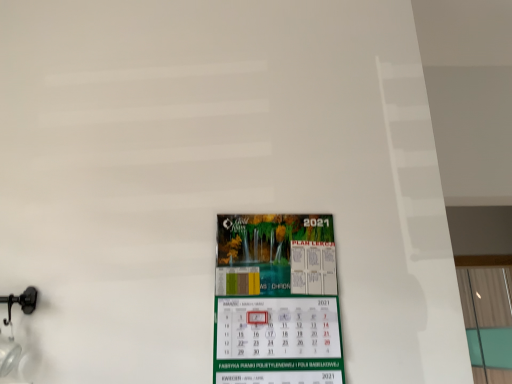
Identify the location of green paper calendar at center. Image resolution: width=512 pixels, height=384 pixels. (276, 300).

Image resolution: width=512 pixels, height=384 pixels. What do you see at coordinates (276, 300) in the screenshot?
I see `green paper calendar at center` at bounding box center [276, 300].

The height and width of the screenshot is (384, 512). Describe the element at coordinates (488, 321) in the screenshot. I see `transparent glass window at right` at that location.

This screenshot has width=512, height=384. I want to click on transparent glass window at right, so click(x=488, y=321).

In order to click on green paper calendar at center in this screenshot , I will do `click(276, 300)`.

Is green paper calendar at center to the left or to the right of transparent glass window at right in the image?

Clearly, green paper calendar at center is on the left of transparent glass window at right in the image.

Considering the positions of objects green paper calendar at center and transparent glass window at right in the image provided, who is behind, green paper calendar at center or transparent glass window at right?

transparent glass window at right is further from the camera.

Which is less distant, (288,339) or (494,308)?

Point (288,339) is closer to the camera than point (494,308).

From the image's perspective, which one is positioned lower, green paper calendar at center or transparent glass window at right?

transparent glass window at right is shown below in the image.

From a real-world perspective, between green paper calendar at center and transparent glass window at right, who is vertically higher?

transparent glass window at right is physically above.

Considering the sizes of objects green paper calendar at center and transparent glass window at right in the image provided, who is thinner, green paper calendar at center or transparent glass window at right?

green paper calendar at center is thinner.

From the picture: Who is shorter, green paper calendar at center or transparent glass window at right?

Standing shorter between the two is green paper calendar at center.

Who is bigger, green paper calendar at center or transparent glass window at right?

transparent glass window at right is bigger.

Would you say green paper calendar at center is outside transparent glass window at right?

Indeed, green paper calendar at center is completely outside transparent glass window at right.

Is green paper calendar at center not near transparent glass window at right?

That's right, there is a large distance between green paper calendar at center and transparent glass window at right.

Is transparent glass window at right at the back of green paper calendar at center?

green paper calendar at center does not have its back to transparent glass window at right.

Locate an element on the screen. window above the green paper calendar at center (from a real-world perspective) is located at coordinates (488, 321).

Considering the relative positions of transparent glass window at right and green paper calendar at center in the image provided, is transparent glass window at right to the right of green paper calendar at center from the viewer's perspective?

Yes.

Between transparent glass window at right and green paper calendar at center, which one is positioned in front?

green paper calendar at center is more forward.

Is point (486, 370) positioned before point (312, 236)?

No, it is not.

From the image's perspective, is transparent glass window at right over green paper calendar at center?

Actually, transparent glass window at right appears below green paper calendar at center in the image.

From a real-world perspective, is transparent glass window at right physically above green paper calendar at center?

Indeed, from a real-world perspective, transparent glass window at right stands above green paper calendar at center.

Does transparent glass window at right have a lesser width compared to green paper calendar at center?

In fact, transparent glass window at right might be wider than green paper calendar at center.

Can you confirm if transparent glass window at right is taller than green paper calendar at center?

Yes, transparent glass window at right is taller than green paper calendar at center.

Which of these two, transparent glass window at right or green paper calendar at center, is bigger?

With larger size is transparent glass window at right.

Is green paper calendar at center inside transparent glass window at right?

That's incorrect, green paper calendar at center is not inside transparent glass window at right.

Is transparent glass window at right not close to green paper calendar at center?

That's right, there is a large distance between transparent glass window at right and green paper calendar at center.

Consider the image. Is transparent glass window at right aimed at green paper calendar at center?

No, transparent glass window at right is not facing towards green paper calendar at center.

Can you tell me how much transparent glass window at right and green paper calendar at center differ in facing direction?

There is a 90.4-degree angle between the facing directions of transparent glass window at right and green paper calendar at center.

Identify the location of window located above the green paper calendar at center (from a real-world perspective). This screenshot has height=384, width=512. (488, 321).

This screenshot has width=512, height=384. I want to click on window that is below the green paper calendar at center (from the image's perspective), so click(x=488, y=321).

Locate an element on the screen. poster to the left of transparent glass window at right is located at coordinates (276, 300).